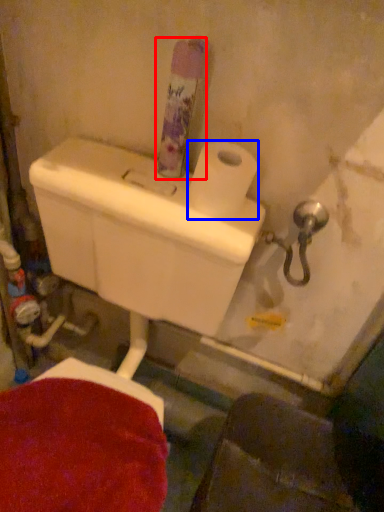
Question: Which of the following is the closest to the observer, toiletry (highlighted by a red box) or toilet paper (highlighted by a blue box)?

Choices:
 (A) toiletry
 (B) toilet paper

Answer: (A)